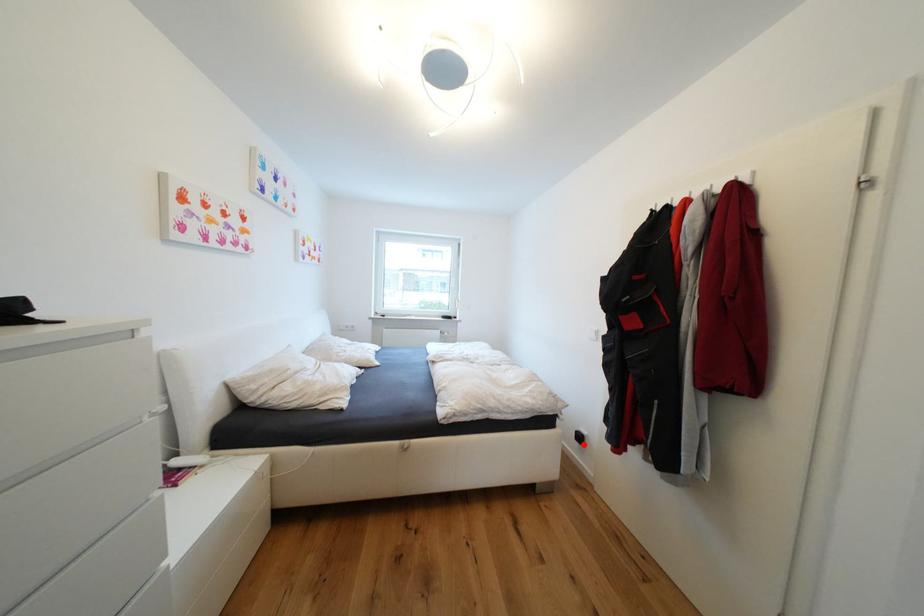
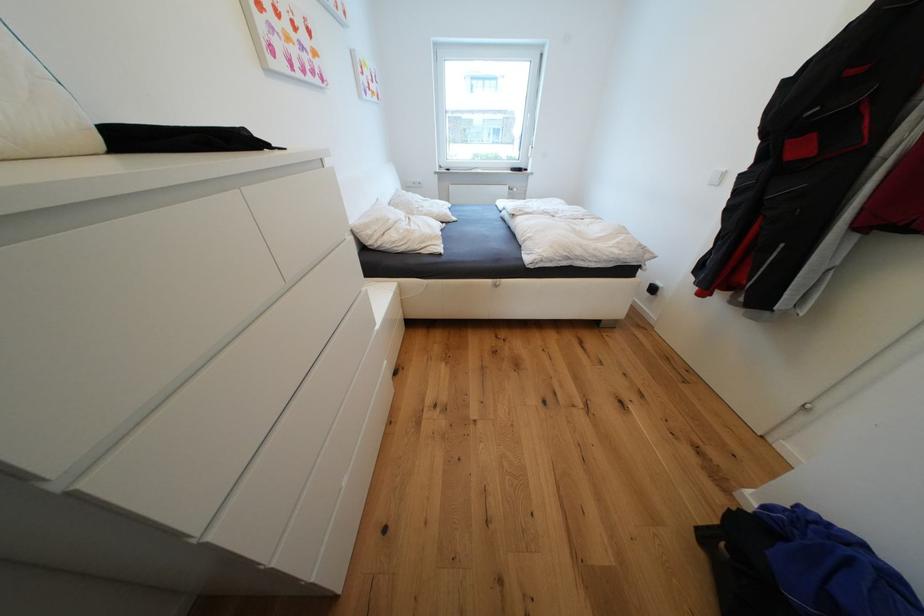
The point at the highlighted location is marked in the first image. Where is the corresponding point in the second image?

(653, 294)